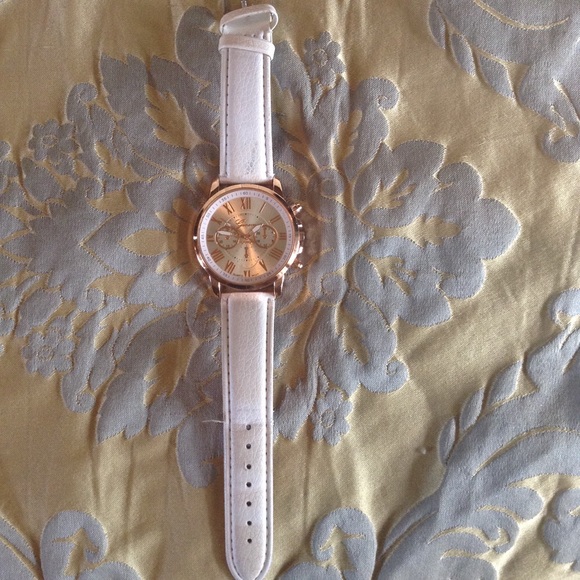
Where is `blanket`? The width and height of the screenshot is (580, 580). blanket is located at coordinates (380, 466).